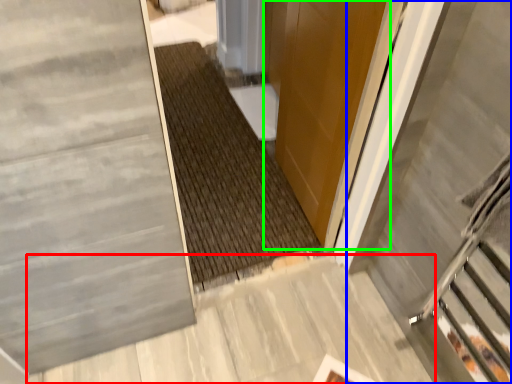
Question: Considering the real-world distances, which object is farthest from concrete (highlighted by a red box)? escalator (highlighted by a blue box) or door (highlighted by a green box)?

Choices:
 (A) escalator
 (B) door

Answer: (B)